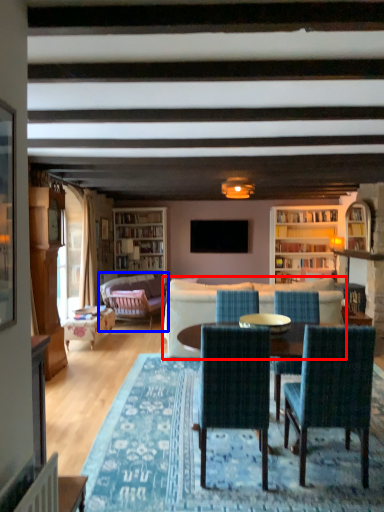
Question: Which object appears farthest to the camera in this image, studio couch (highlighted by a red box) or studio couch (highlighted by a blue box)?

Choices:
 (A) studio couch
 (B) studio couch

Answer: (B)